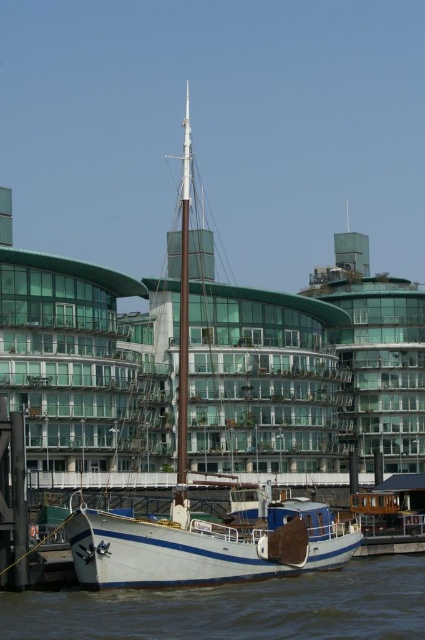
Is point (277, 620) positioned behind point (274, 572)?

That is False.

Does white smooth water at lower center have a lesser height compared to white wooden boat at lower center?

Correct, white smooth water at lower center is not as tall as white wooden boat at lower center.

Where is `white smooth water at lower center`? This screenshot has height=640, width=425. white smooth water at lower center is located at coordinates (235, 609).

Does white matte boat at center have a lesser width compared to white wooden boat at lower center?

Indeed, white matte boat at center has a lesser width compared to white wooden boat at lower center.

Can you confirm if white matte boat at center is positioned above white wooden boat at lower center?

Yes, white matte boat at center is above white wooden boat at lower center.

Who is more distant from viewer, (212, 550) or (232, 570)?

Positioned behind is point (232, 570).

What are the coordinates of `white matte boat at center` in the screenshot? It's located at (201, 518).

Can you confirm if white smooth water at lower center is smaller than white matte mast at center?

Indeed, white smooth water at lower center has a smaller size compared to white matte mast at center.

Is white smooth water at lower center bigger than white matte mast at center?

No, white smooth water at lower center is not bigger than white matte mast at center.

Does point (138, 611) come in front of point (187, 164)?

Yes, point (138, 611) is in front of point (187, 164).

This screenshot has width=425, height=640. I want to click on white smooth water at lower center, so click(x=235, y=609).